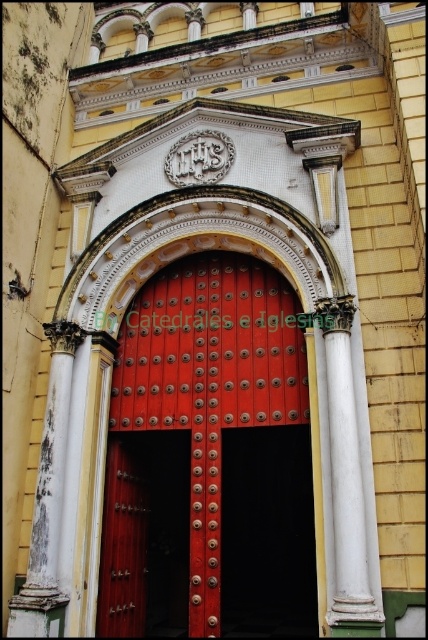
Question: Observing the image, what is the correct spatial positioning of shiny metal door at center in reference to white marble column at center?

Choices:
 (A) right
 (B) left

Answer: (B)

Question: Among these points, which one is nearest to the camera?

Choices:
 (A) (335, 470)
 (B) (169, 394)

Answer: (A)

Question: Does shiny metal door at center have a smaller size compared to white weathered column at left?

Choices:
 (A) yes
 (B) no

Answer: (B)

Question: Which object appears farthest from the camera in this image?

Choices:
 (A) white weathered column at left
 (B) shiny metal door at center

Answer: (B)

Question: Among these points, which one is farthest from the camera?

Choices:
 (A) (285, 362)
 (B) (55, 545)

Answer: (A)

Question: Does white marble column at center appear on the left side of white weathered column at left?

Choices:
 (A) yes
 (B) no

Answer: (B)